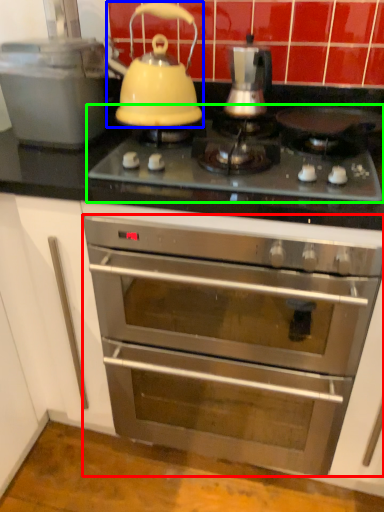
Question: Estimate the real-world distances between objects in this image. Which object is farther from oven (highlighted by a red box), kettle (highlighted by a blue box) or gas stove (highlighted by a green box)?

Choices:
 (A) kettle
 (B) gas stove

Answer: (A)